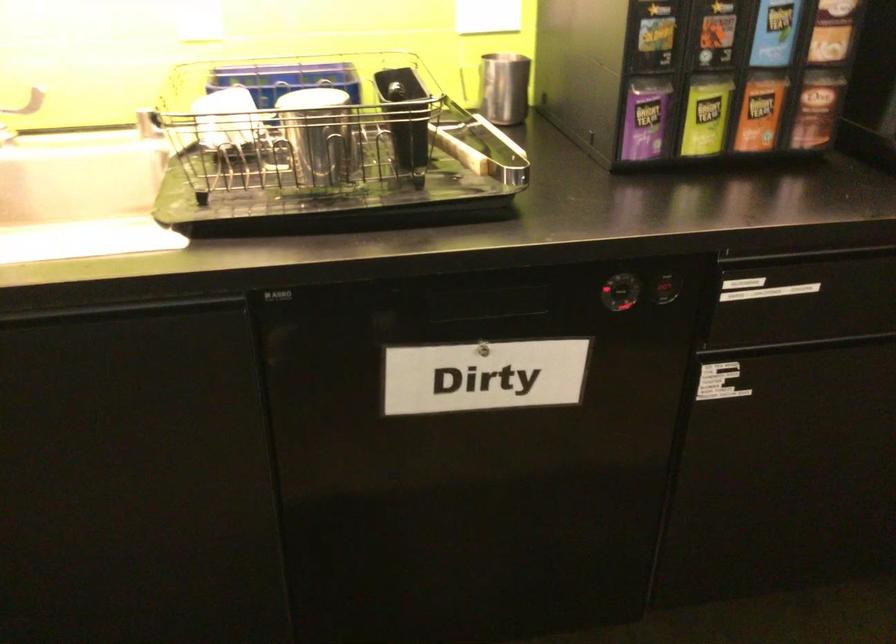
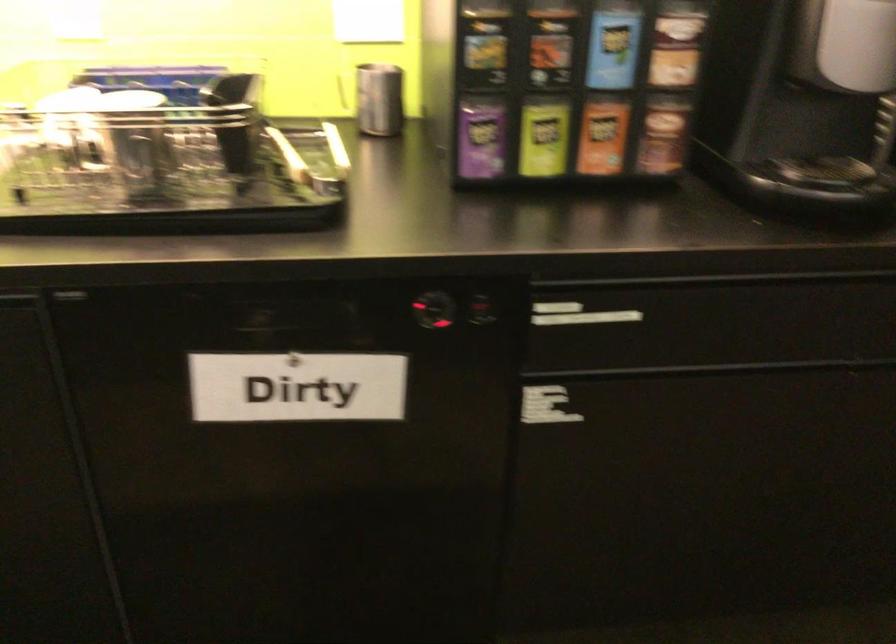
In the second image, find the point that corresponds to the point at 643,120 in the first image.

(479, 138)